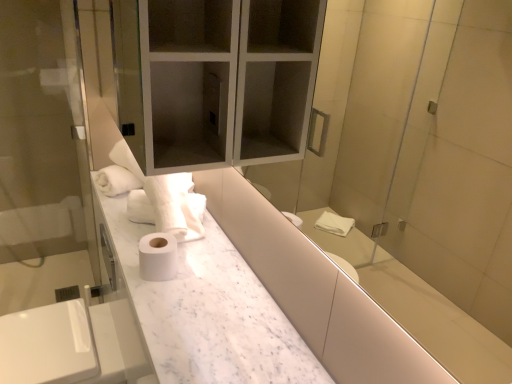
Question: Could you tell me if white marble counter at center is turned towards transparent glass screen door at left?

Choices:
 (A) yes
 (B) no

Answer: (B)

Question: Is white marble counter at center closer to the viewer compared to transparent glass screen door at left?

Choices:
 (A) no
 (B) yes

Answer: (B)

Question: Is transparent glass screen door at left located within white marble counter at center?

Choices:
 (A) yes
 (B) no

Answer: (B)

Question: From the image's perspective, is white marble counter at center over transparent glass screen door at left?

Choices:
 (A) no
 (B) yes

Answer: (A)

Question: Is white marble counter at center at the left side of transparent glass screen door at left?

Choices:
 (A) no
 (B) yes

Answer: (A)

Question: Looking at their shapes, would you say satin nickel faucet at lower left is wider or thinner than white matte toilet paper at center?

Choices:
 (A) wide
 (B) thin

Answer: (B)

Question: Is satin nickel faucet at lower left situated inside white matte toilet paper at center or outside?

Choices:
 (A) outside
 (B) inside

Answer: (A)

Question: Considering the relative positions of satin nickel faucet at lower left and white matte toilet paper at center in the image provided, is satin nickel faucet at lower left to the left or to the right of white matte toilet paper at center?

Choices:
 (A) left
 (B) right

Answer: (A)

Question: Considering the positions of satin nickel faucet at lower left and white matte toilet paper at center in the image, is satin nickel faucet at lower left bigger or smaller than white matte toilet paper at center?

Choices:
 (A) big
 (B) small

Answer: (A)

Question: Do you think white matte toilet paper at center is within satin nickel faucet at lower left, or outside of it?

Choices:
 (A) outside
 (B) inside

Answer: (A)

Question: From a real-world perspective, is white matte toilet paper at center positioned above or below satin nickel faucet at lower left?

Choices:
 (A) above
 (B) below

Answer: (A)

Question: From the image's perspective, is white matte toilet paper at center located above or below satin nickel faucet at lower left?

Choices:
 (A) below
 (B) above

Answer: (B)

Question: Is white matte toilet paper at center bigger or smaller than satin nickel faucet at lower left?

Choices:
 (A) big
 (B) small

Answer: (B)

Question: Looking at their shapes, would you say transparent glass screen door at left is wider or thinner than white marble counter at center?

Choices:
 (A) thin
 (B) wide

Answer: (A)

Question: From their relative heights in the image, would you say transparent glass screen door at left is taller or shorter than white marble counter at center?

Choices:
 (A) tall
 (B) short

Answer: (A)